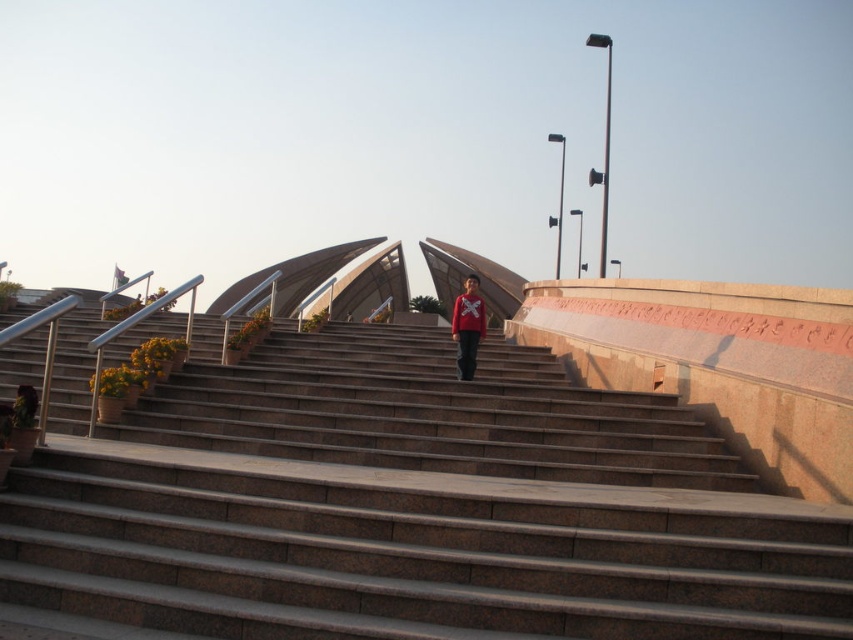
You are carrying a matte red sweater at center and want to place it on the brown stone stairs at center. Will the sweater fit entirely on the stairs without overlapping the edges?

The brown stone stairs at center are wider than the matte red sweater at center, so the sweater will fit entirely without overlapping the edges.

You are standing at the bottom of the brown stone stairs at center and want to place a matte red sweater at center on the stairs. Considering their sizes, will the sweater fit on the stairs?

The brown stone stairs at center is bigger than matte red sweater at center, so the sweater will fit on the stairs since it is smaller in size.